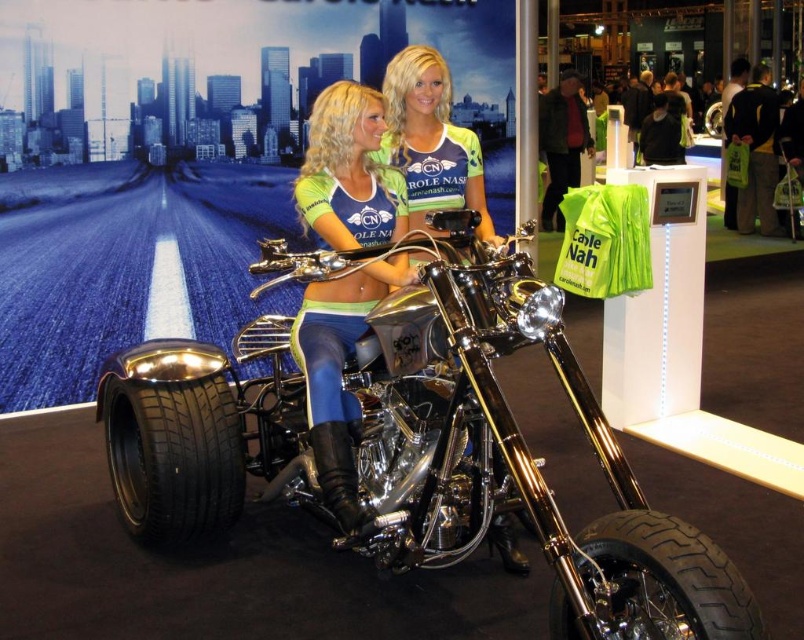
You are a photographer at the exhibition and need to capture a closeup shot of the shiny metallic tank top at center without the black rubber tire at lower right appearing in the frame. Is the tire too wide to avoid?

The black rubber tire at lower right has a lesser width compared to shiny metallic tank top at center, so the tire is narrower. Therefore, it should be possible to position the camera to exclude the tire from the frame while focusing on the tank top.

You are a photographer at the exhibition and want to capture a photo of the shiny metallic tank top at center without the black rubber tire at lower right appearing in the frame. Based on their positions, is this possible?

The black rubber tire at lower right is to the right of the shiny metallic tank top at center, so if you position your camera to the left side of the shiny metallic tank top at center, you can exclude the black rubber tire at lower right from the frame.